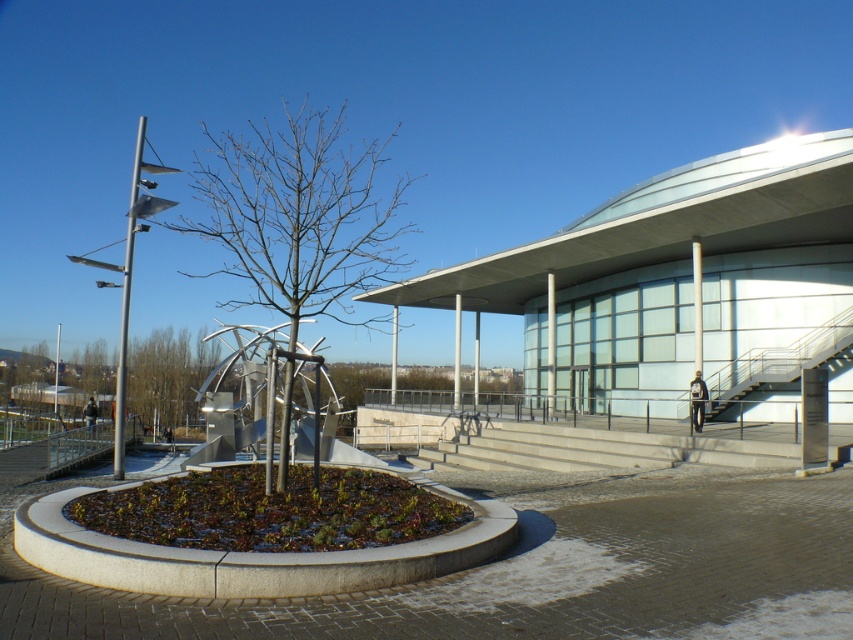
Question: Does concrete stairs at center appear over metallic gray staircase at right?

Choices:
 (A) no
 (B) yes

Answer: (A)

Question: Which point is farther to the camera?

Choices:
 (A) (778, 460)
 (B) (323, 224)
 (C) (722, 410)

Answer: (C)

Question: Considering the relative positions of bare branches at center and concrete stairs at center in the image provided, where is bare branches at center located with respect to concrete stairs at center?

Choices:
 (A) below
 (B) above

Answer: (B)

Question: Among these points, which one is farthest from the camera?

Choices:
 (A) (483, 468)
 (B) (836, 358)

Answer: (B)

Question: Which point is farther to the camera?

Choices:
 (A) (759, 371)
 (B) (296, 148)

Answer: (A)

Question: Does bare branches at center lie behind metallic gray staircase at right?

Choices:
 (A) no
 (B) yes

Answer: (A)